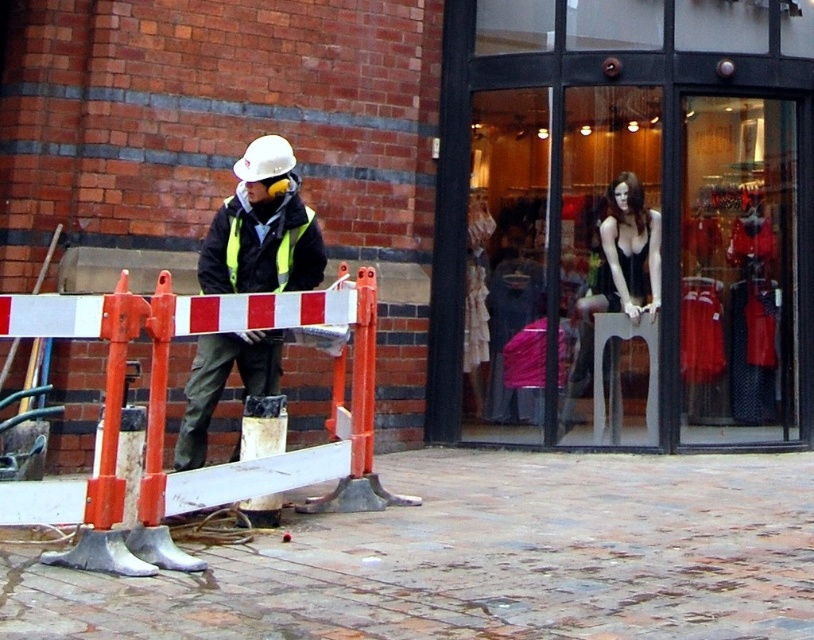
Question: Among these points, which one is nearest to the camera?

Choices:
 (A) (279, 145)
 (B) (742, 284)

Answer: (A)

Question: Which of the following is the closest to the observer?

Choices:
 (A) clear glass mannequin at center
 (B) reflective yellow vest at center
 (C) reflective yellow-green jacket at center

Answer: (B)

Question: Which of these objects is positioned farthest from the reflective yellow vest at center?

Choices:
 (A) clear glass mannequin at center
 (B) reflective yellow-green jacket at center

Answer: (A)

Question: In this image, where is clear glass mannequin at center located relative to reflective yellow vest at center?

Choices:
 (A) right
 (B) left

Answer: (A)

Question: Is clear glass mannequin at center thinner than reflective yellow-green jacket at center?

Choices:
 (A) no
 (B) yes

Answer: (A)

Question: Is clear glass mannequin at center above reflective yellow vest at center?

Choices:
 (A) yes
 (B) no

Answer: (A)